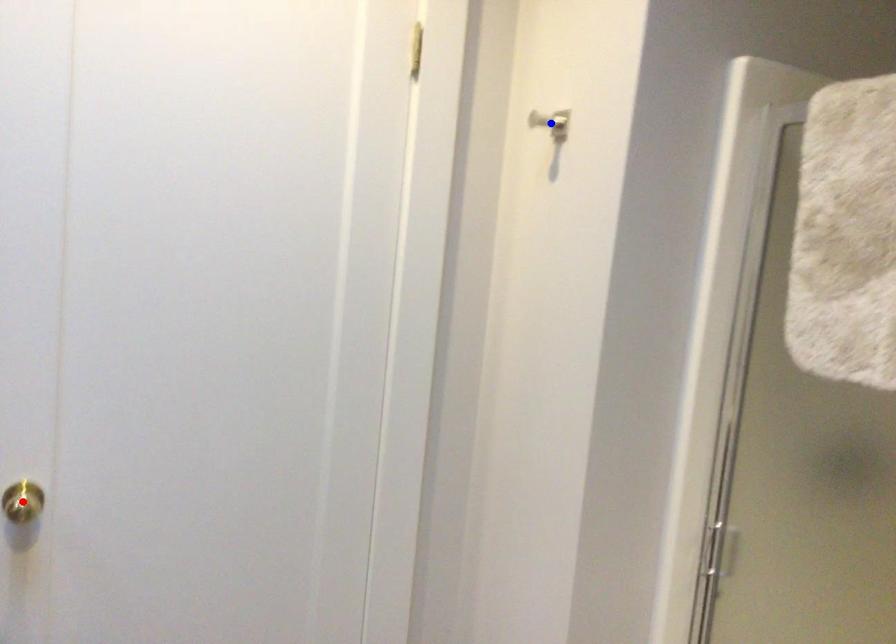
Question: Two points are marked on the image. Which point is closer to the camera?

Choices:
 (A) Blue point is closer.
 (B) Red point is closer.

Answer: (B)